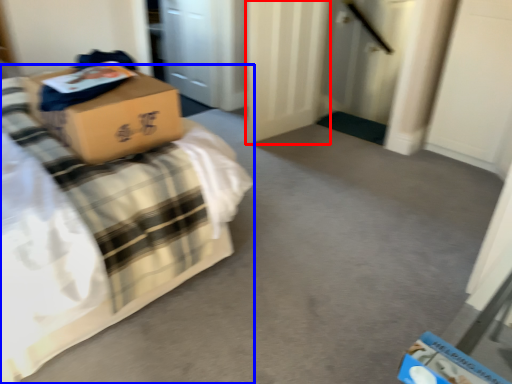
Question: Which object appears farthest to the camera in this image, door (highlighted by a red box) or bed (highlighted by a blue box)?

Choices:
 (A) door
 (B) bed

Answer: (A)